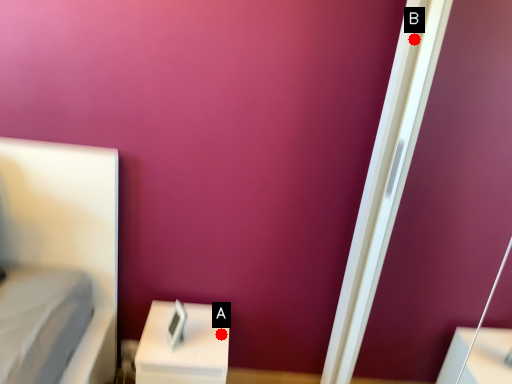
Question: Two points are circled on the image, labeled by A and B beside each circle. Which point is closer to the camera?

Choices:
 (A) A is closer
 (B) B is closer

Answer: (B)